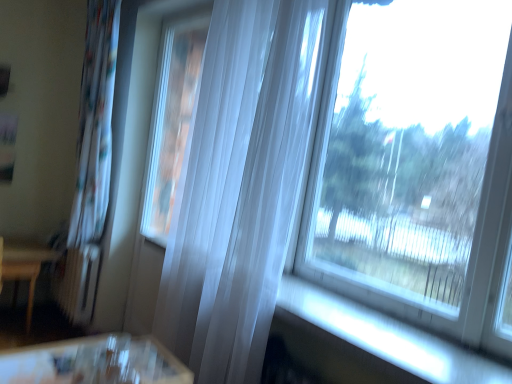
Where is `translucent white curtain at center, the 1th curtain positioned from the front`? This screenshot has width=512, height=384. translucent white curtain at center, the 1th curtain positioned from the front is located at coordinates (239, 187).

What do you see at coordinates (415, 164) in the screenshot? This screenshot has height=384, width=512. I see `transparent glass window at upper right` at bounding box center [415, 164].

This screenshot has width=512, height=384. I want to click on translucent white curtain at center, which appears as the second curtain when viewed from the back, so click(x=239, y=187).

How much distance is there between wooden table at left and white sheer curtain at left, placed as the first curtain when sorted from left to right?

wooden table at left is 23.31 inches from white sheer curtain at left, placed as the first curtain when sorted from left to right.

From the image's perspective, is wooden table at left beneath white sheer curtain at left, the 2th curtain positioned from the right?

Yes, from the image's perspective, wooden table at left is beneath white sheer curtain at left, the 2th curtain positioned from the right.

Between wooden table at left and white sheer curtain at left, the first curtain in the back-to-front sequence, which one has larger width?

With larger width is wooden table at left.

Is wooden table at left aimed at white sheer curtain at left, the first curtain in the back-to-front sequence?

No, wooden table at left is not facing towards white sheer curtain at left, the first curtain in the back-to-front sequence.

Is point (106, 174) positioned after point (246, 75)?

Yes.

Considering the sizes of white sheer curtain at left, the first curtain in the back-to-front sequence, and translucent white curtain at center, the 1th curtain positioned from the front, in the image, is white sheer curtain at left, the first curtain in the back-to-front sequence, wider or thinner than translucent white curtain at center, the 1th curtain positioned from the front,?

Considering their sizes, white sheer curtain at left, the first curtain in the back-to-front sequence, looks broader than translucent white curtain at center, the 1th curtain positioned from the front.

Is white sheer curtain at left, placed as the first curtain when sorted from left to right, oriented towards translucent white curtain at center, the first curtain viewed from the right?

No.

Which is more to the left, white sheer curtain at left, placed as the first curtain when sorted from left to right, or translucent white curtain at center, which appears as the second curtain when viewed from the back?

white sheer curtain at left, placed as the first curtain when sorted from left to right.

Can you confirm if wooden table at left is taller than translucent white curtain at center, which appears as the second curtain when viewed from the back?

No, wooden table at left is not taller than translucent white curtain at center, which appears as the second curtain when viewed from the back.

Is wooden table at left oriented towards translucent white curtain at center, which appears as the second curtain when viewed from the back?

Yes, wooden table at left is oriented towards translucent white curtain at center, which appears as the second curtain when viewed from the back.

The image size is (512, 384). Find the location of `furniture on the left of translucent white curtain at center, the 1th curtain positioned from the front`. furniture on the left of translucent white curtain at center, the 1th curtain positioned from the front is located at coordinates (23, 267).

Consider the image. What's the angular difference between wooden table at left and translucent white curtain at center, which appears as the second curtain when viewed from the back,'s facing directions?

90.2 degrees separate the facing orientations of wooden table at left and translucent white curtain at center, which appears as the second curtain when viewed from the back.

Which of these two, transparent glass window at upper right or white sheer curtain at left, the 2th curtain positioned from the right, is wider?

Wider between the two is white sheer curtain at left, the 2th curtain positioned from the right.

From the picture: Measure the distance from transparent glass window at upper right to white sheer curtain at left, the 2th curtain positioned from the right.

2.03 meters.

Are transparent glass window at upper right and white sheer curtain at left, which is the 2th curtain in front-to-back order, beside each other?

There is a gap between transparent glass window at upper right and white sheer curtain at left, which is the 2th curtain in front-to-back order.

Could you tell me if transparent glass window at upper right is turned towards white sheer curtain at left, placed as the first curtain when sorted from left to right?

No, transparent glass window at upper right is not oriented towards white sheer curtain at left, placed as the first curtain when sorted from left to right.

Considering the relative sizes of wooden table at left and transparent glass window at upper right in the image provided, is wooden table at left bigger than transparent glass window at upper right?

Yes, wooden table at left is bigger than transparent glass window at upper right.

Is wooden table at left turned away from transparent glass window at upper right?

No.

From the image's perspective, which one is positioned higher, wooden table at left or transparent glass window at upper right?

transparent glass window at upper right appears higher in the image.

From the picture: Does wooden table at left touch transparent glass window at upper right?

No, wooden table at left is not with transparent glass window at upper right.

Is transparent glass window at upper right located outside translucent white curtain at center, the 1th curtain positioned from the front?

transparent glass window at upper right is positioned outside translucent white curtain at center, the 1th curtain positioned from the front.

From the picture: Which object is positioned more to the left, transparent glass window at upper right or translucent white curtain at center, the 1th curtain positioned from the front?

translucent white curtain at center, the 1th curtain positioned from the front, is more to the left.

Are transparent glass window at upper right and translucent white curtain at center, which appears as the second curtain when viewed from the back, making contact?

No, transparent glass window at upper right is not touching translucent white curtain at center, which appears as the second curtain when viewed from the back.

Locate an element on the screen. This screenshot has width=512, height=384. window above the translucent white curtain at center, the first curtain viewed from the right (from the image's perspective) is located at coordinates (415, 164).

Would you say wooden table at left is part of translucent white curtain at center, the first curtain viewed from the right,'s contents?

That's incorrect, wooden table at left is not inside translucent white curtain at center, the first curtain viewed from the right.

Who is bigger, translucent white curtain at center, which appears as the second curtain when viewed from the back, or wooden table at left?

translucent white curtain at center, which appears as the second curtain when viewed from the back.

From the image's perspective, would you say translucent white curtain at center, which appears as the second curtain when viewed from the back, is shown under wooden table at left?

No, from the image's perspective, translucent white curtain at center, which appears as the second curtain when viewed from the back, is not below wooden table at left.

Does translucent white curtain at center, the first curtain viewed from the right, appear on the left side of wooden table at left?

Incorrect, translucent white curtain at center, the first curtain viewed from the right, is not on the left side of wooden table at left.

This screenshot has width=512, height=384. Find the location of `furniture lying below the white sheer curtain at left, the 2th curtain positioned from the right (from the image's perspective)`. furniture lying below the white sheer curtain at left, the 2th curtain positioned from the right (from the image's perspective) is located at coordinates (23, 267).

Locate an element on the screen. curtain above the translucent white curtain at center, the 1th curtain positioned from the front (from the image's perspective) is located at coordinates (91, 163).

When comparing their distances from transparent glass window at upper right, does translucent white curtain at center, the 1th curtain positioned from the front, or white sheer curtain at left, the 2th curtain positioned from the right, seem closer?

The object closer to transparent glass window at upper right is translucent white curtain at center, the 1th curtain positioned from the front.

Based on their spatial positions, is transparent glass window at upper right or translucent white curtain at center, the 1th curtain positioned from the front, further from white sheer curtain at left, the first curtain in the back-to-front sequence?

transparent glass window at upper right is positioned further to the anchor white sheer curtain at left, the first curtain in the back-to-front sequence.

Looking at the image, which one is located further to white sheer curtain at left, the 2th curtain positioned from the right, wooden table at left or translucent white curtain at center, which appears as the second curtain when viewed from the back?

translucent white curtain at center, which appears as the second curtain when viewed from the back, lies further to white sheer curtain at left, the 2th curtain positioned from the right, than the other object.

In the scene shown: Looking at the image, which one is located further to transparent glass window at upper right, wooden table at left or white sheer curtain at left, the 2th curtain positioned from the right?

wooden table at left is positioned further to the anchor transparent glass window at upper right.

Looking at the image, which one is located further to white sheer curtain at left, which is the 2th curtain in front-to-back order, translucent white curtain at center, acting as the 2th curtain starting from the left, or wooden table at left?

translucent white curtain at center, acting as the 2th curtain starting from the left, is further to white sheer curtain at left, which is the 2th curtain in front-to-back order.

In the scene shown: From the image, which object appears to be nearer to translucent white curtain at center, acting as the 2th curtain starting from the left, wooden table at left or transparent glass window at upper right?

transparent glass window at upper right lies closer to translucent white curtain at center, acting as the 2th curtain starting from the left, than the other object.

In the scene shown: When comparing their distances from white sheer curtain at left, which is the 2th curtain in front-to-back order, does transparent glass window at upper right or wooden table at left seem further?

Based on the image, transparent glass window at upper right appears to be further to white sheer curtain at left, which is the 2th curtain in front-to-back order.

When comparing their distances from wooden table at left, does translucent white curtain at center, the 1th curtain positioned from the front, or white sheer curtain at left, the 2th curtain positioned from the right, seem closer?

Based on the image, white sheer curtain at left, the 2th curtain positioned from the right, appears to be nearer to wooden table at left.

The image size is (512, 384). Find the location of `curtain between white sheer curtain at left, the 2th curtain positioned from the right, and transparent glass window at upper right, in the horizontal direction`. curtain between white sheer curtain at left, the 2th curtain positioned from the right, and transparent glass window at upper right, in the horizontal direction is located at coordinates (239, 187).

This screenshot has width=512, height=384. Identify the location of curtain between wooden table at left and translucent white curtain at center, acting as the 2th curtain starting from the left, from left to right. (91, 163).